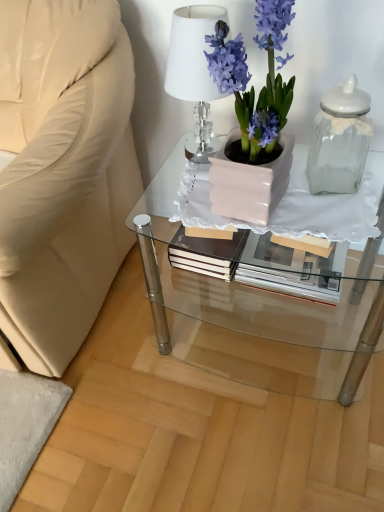
Where is `blank space above white crystal lamp at upper center (from a real-world perspective)`? The image size is (384, 512). blank space above white crystal lamp at upper center (from a real-world perspective) is located at coordinates (201, 8).